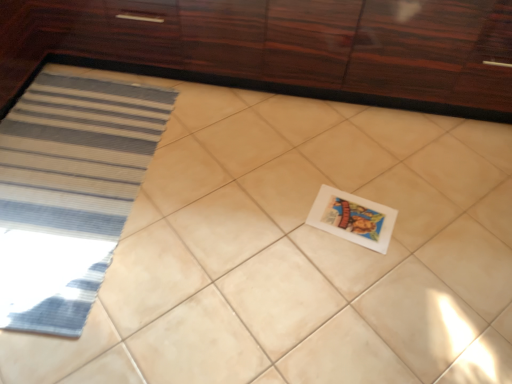
The image size is (512, 384). Describe the element at coordinates (353, 218) in the screenshot. I see `white matte postcard at center` at that location.

Find the location of a particular element. The height and width of the screenshot is (384, 512). white matte postcard at center is located at coordinates (353, 218).

The height and width of the screenshot is (384, 512). What do you see at coordinates (279, 48) in the screenshot?
I see `glossy wood cabinetry at upper center` at bounding box center [279, 48].

You are a GUI agent. You are given a task and a screenshot of the screen. Output one action in this format:
    pyautogui.click(x=<x>, y=<y>)
    Task: Click on the glossy wood cabinetry at upper center
    The width and height of the screenshot is (512, 384).
    Given the screenshot: What is the action you would take?
    pyautogui.click(x=279, y=48)

Find the location of a particular element. This screenshot has width=512, height=384. white matte postcard at center is located at coordinates (353, 218).

Between white matte postcard at center and glossy wood cabinetry at upper center, which one appears on the right side from the viewer's perspective?

From the viewer's perspective, white matte postcard at center appears more on the right side.

Is white matte postcard at center positioned behind glossy wood cabinetry at upper center?

Yes.

Does point (338, 218) come farther from viewer compared to point (487, 56)?

No, (338, 218) is in front of (487, 56).

In the scene shown: From the image's perspective, which object appears higher, white matte postcard at center or glossy wood cabinetry at upper center?

From the image's view, glossy wood cabinetry at upper center is above.

From a real-world perspective, is white matte postcard at center on top of glossy wood cabinetry at upper center?

Actually, white matte postcard at center is physically below glossy wood cabinetry at upper center in the real world.

Considering the sizes of objects white matte postcard at center and glossy wood cabinetry at upper center in the image provided, who is wider, white matte postcard at center or glossy wood cabinetry at upper center?

With larger width is glossy wood cabinetry at upper center.

Considering the relative sizes of white matte postcard at center and glossy wood cabinetry at upper center in the image provided, is white matte postcard at center shorter than glossy wood cabinetry at upper center?

Correct, white matte postcard at center is not as tall as glossy wood cabinetry at upper center.

Which of these two, white matte postcard at center or glossy wood cabinetry at upper center, is smaller?

white matte postcard at center.

Is white matte postcard at center not within glossy wood cabinetry at upper center?

white matte postcard at center is positioned outside glossy wood cabinetry at upper center.

Is white matte postcard at center far away from glossy wood cabinetry at upper center?

white matte postcard at center is near glossy wood cabinetry at upper center, not far away.

Is white matte postcard at center oriented away from glossy wood cabinetry at upper center?

No, white matte postcard at center is not facing away from glossy wood cabinetry at upper center.

The height and width of the screenshot is (384, 512). I want to click on cabinetry on the left side of white matte postcard at center, so click(x=279, y=48).

Is glossy wood cabinetry at upper center at the right side of white matte postcard at center?

In fact, glossy wood cabinetry at upper center is to the left of white matte postcard at center.

Is glossy wood cabinetry at upper center in front of white matte postcard at center?

Yes.

Is point (31, 5) in front of point (313, 207)?

No, it is behind (313, 207).

From the image's perspective, is glossy wood cabinetry at upper center beneath white matte postcard at center?

No.

Looking at this image, from a real-world perspective, is glossy wood cabinetry at upper center beneath white matte postcard at center?

Actually, glossy wood cabinetry at upper center is physically above white matte postcard at center in the real world.

Is glossy wood cabinetry at upper center wider or thinner than white matte postcard at center?

In the image, glossy wood cabinetry at upper center appears to be wider than white matte postcard at center.

Does glossy wood cabinetry at upper center have a lesser height compared to white matte postcard at center?

Incorrect, the height of glossy wood cabinetry at upper center does not fall short of that of white matte postcard at center.

Considering the sizes of objects glossy wood cabinetry at upper center and white matte postcard at center in the image provided, who is smaller, glossy wood cabinetry at upper center or white matte postcard at center?

Smaller between the two is white matte postcard at center.

In the scene shown: Is white matte postcard at center a part of glossy wood cabinetry at upper center?

Actually, white matte postcard at center is outside glossy wood cabinetry at upper center.

Is glossy wood cabinetry at upper center far away from white matte postcard at center?

No, glossy wood cabinetry at upper center is not far from white matte postcard at center.

Is glossy wood cabinetry at upper center positioned with its back to white matte postcard at center?

That's not correct — glossy wood cabinetry at upper center is not looking away from white matte postcard at center.

Where is `postcard lying on the right of glossy wood cabinetry at upper center`? The width and height of the screenshot is (512, 384). postcard lying on the right of glossy wood cabinetry at upper center is located at coordinates (353, 218).

Image resolution: width=512 pixels, height=384 pixels. What are the coordinates of `cabinetry above the white matte postcard at center (from a real-world perspective)` in the screenshot? It's located at (279, 48).

Where is `postcard that is below the glossy wood cabinetry at upper center (from the image's perspective)`? The width and height of the screenshot is (512, 384). postcard that is below the glossy wood cabinetry at upper center (from the image's perspective) is located at coordinates (353, 218).